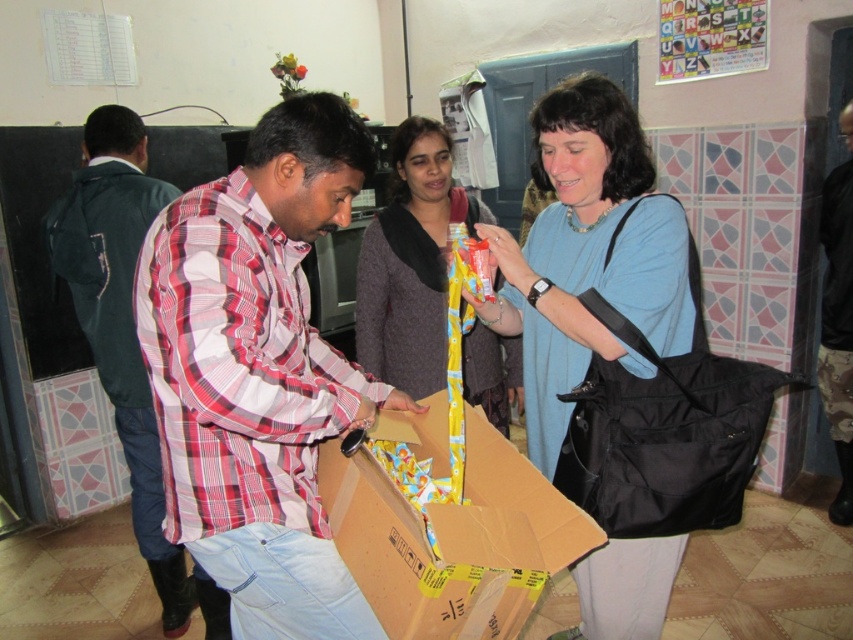
Looking at this image, you are a fashion designer observing the scene. You notice the blue fabric dress at center and the camouflage pants at lower right. Which clothing item is located lower in the image?

The blue fabric dress at center is positioned under camouflage pants at lower right, meaning the blue fabric dress at center is lower in the image.